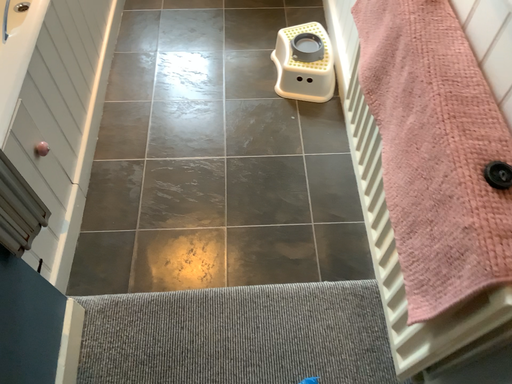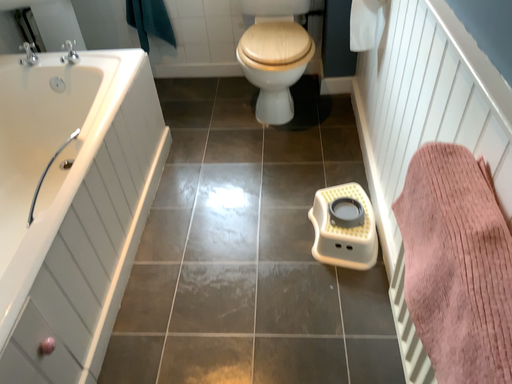
Question: Which way did the camera rotate in the video?

Choices:
 (A) rotated upward
 (B) rotated downward

Answer: (A)